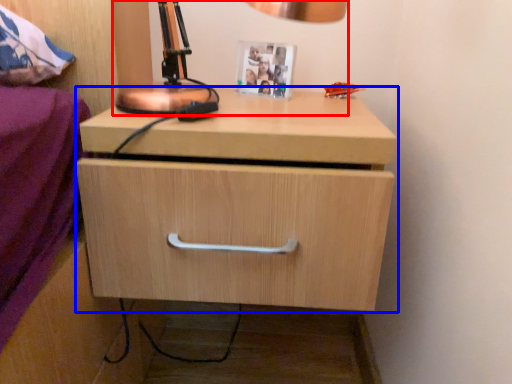
Question: Which point is closer to the camera, table lamp (highlighted by a red box) or chest of drawers (highlighted by a blue box)?

Choices:
 (A) table lamp
 (B) chest of drawers

Answer: (A)